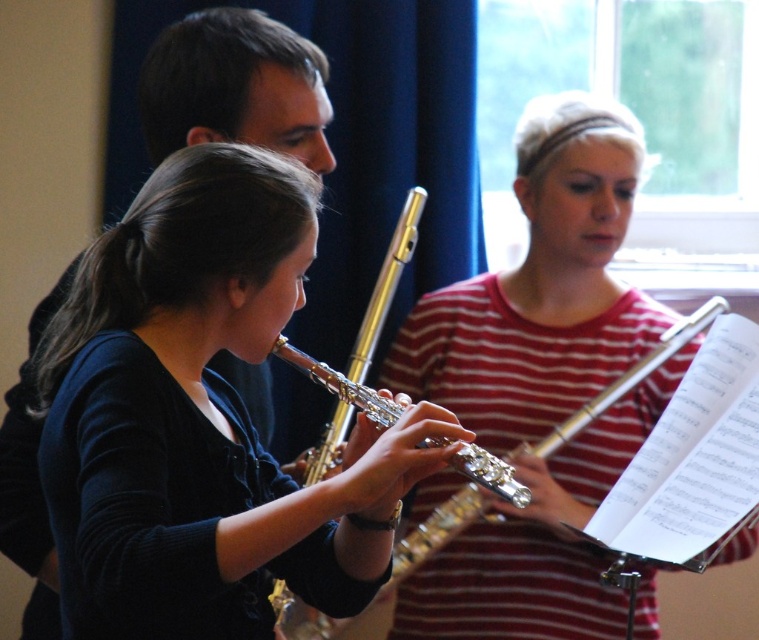
You are a music teacher setting up a music class. You have two flutes, the matte gold flute at center and the metallic flute at center. You want to place them on a shelf that can only hold items within 30 inches of each other. Can both flutes be placed on the same shelf?

The matte gold flute at center is 31.64 inches away from the metallic flute at center, which exceeds the shelf requirement of 30 inches. Therefore, both flutes cannot be placed on the same shelf.